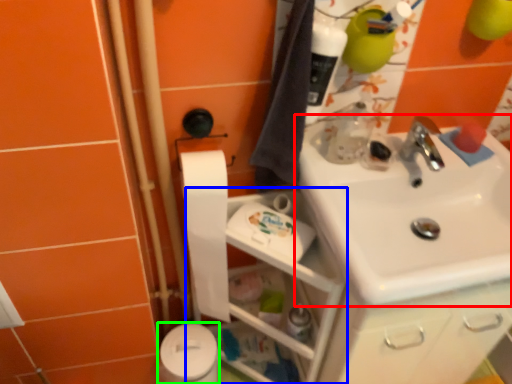
Question: Based on their relative distances, which object is nearer to sink (highlighted by a red box)? Choose from shelf (highlighted by a blue box) and toilet paper (highlighted by a green box).

Choices:
 (A) shelf
 (B) toilet paper

Answer: (A)